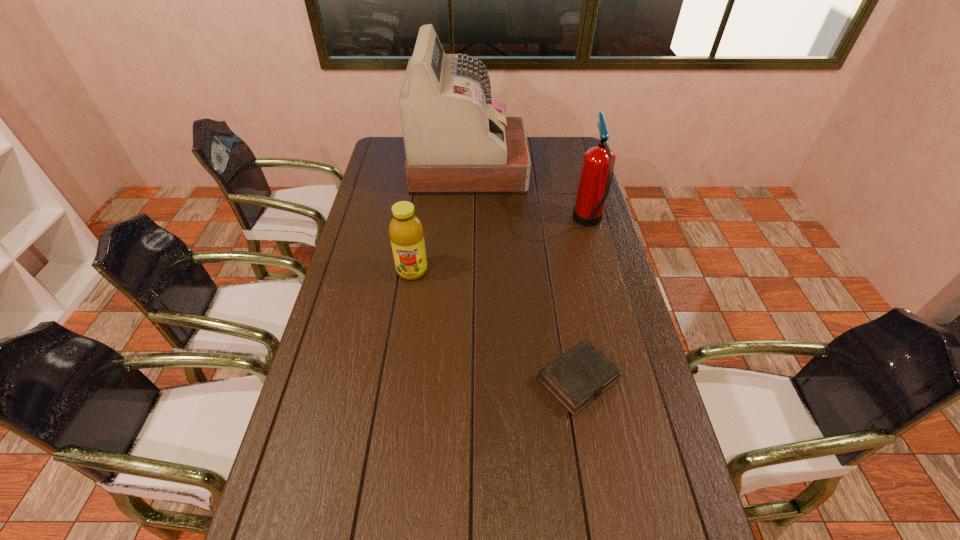
This screenshot has height=540, width=960. Identify the location of vacant space that's between the second shortest object and the fire extinguisher. (500, 247).

I want to click on unoccupied position between the nearest object and the second shortest object, so click(495, 325).

Find the location of `free area in between the second nearest object and the fire extinguisher`. free area in between the second nearest object and the fire extinguisher is located at coordinates (500, 247).

Locate an element on the screen. free point between the second farthest object and the book is located at coordinates point(583,301).

Find the location of a particular element. The image size is (960, 540). free spot between the third shortest object and the shortest object is located at coordinates (583, 301).

The height and width of the screenshot is (540, 960). Identify the location of vacant region between the fire extinguisher and the book. (583, 301).

I want to click on vacant space in between the tallest object and the book, so click(x=523, y=273).

Find the location of a particular element. free space that is in between the fire extinguisher and the fruit juice is located at coordinates (500, 247).

Where is `object that can be found as the third closest to the nearest object`? The height and width of the screenshot is (540, 960). object that can be found as the third closest to the nearest object is located at coordinates tap(457, 141).

Locate an element on the screen. The height and width of the screenshot is (540, 960). object that is the third closest to the fruit juice is located at coordinates (597, 170).